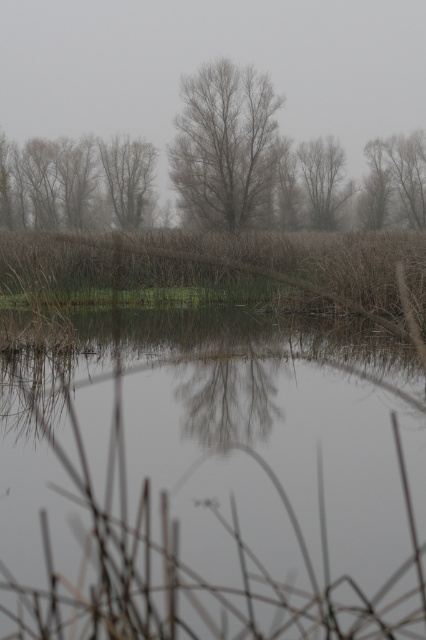
You are standing at the edge of the water in the serene misty landscape. There are two points marked in the scene. The first is at point coordinate (244, 173) and the second is at point coordinate (339, 186). Which of these two points is closer to your current position?

Point (244, 173) is closer to the camera than point (339, 186), so the first point is closer to your current position.